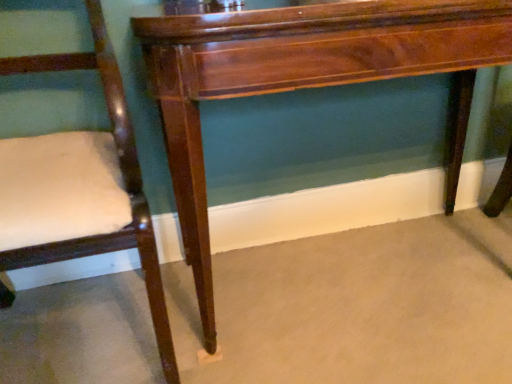
Question: Does matte wood chair at left come in front of mahogany wood table at center?

Choices:
 (A) yes
 (B) no

Answer: (A)

Question: Is matte wood chair at left bigger than mahogany wood table at center?

Choices:
 (A) yes
 (B) no

Answer: (B)

Question: Is matte wood chair at left not within mahogany wood table at center?

Choices:
 (A) no
 (B) yes

Answer: (B)

Question: From a real-world perspective, is matte wood chair at left physically above mahogany wood table at center?

Choices:
 (A) yes
 (B) no

Answer: (A)

Question: Is matte wood chair at left far from mahogany wood table at center?

Choices:
 (A) yes
 (B) no

Answer: (B)

Question: Does matte wood chair at left lie behind mahogany wood table at center?

Choices:
 (A) yes
 (B) no

Answer: (B)

Question: From the image's perspective, would you say mahogany wood table at center is shown under matte wood chair at left?

Choices:
 (A) yes
 (B) no

Answer: (B)

Question: Is mahogany wood table at center positioned before matte wood chair at left?

Choices:
 (A) yes
 (B) no

Answer: (B)

Question: Is mahogany wood table at center to the left of matte wood chair at left from the viewer's perspective?

Choices:
 (A) yes
 (B) no

Answer: (B)

Question: Is mahogany wood table at center at the right side of matte wood chair at left?

Choices:
 (A) no
 (B) yes

Answer: (B)

Question: Is mahogany wood table at center smaller than matte wood chair at left?

Choices:
 (A) no
 (B) yes

Answer: (A)

Question: Is mahogany wood table at center wider than matte wood chair at left?

Choices:
 (A) yes
 (B) no

Answer: (B)

Question: Choose the correct answer: Is mahogany wood table at center inside matte wood chair at left or outside it?

Choices:
 (A) outside
 (B) inside

Answer: (A)